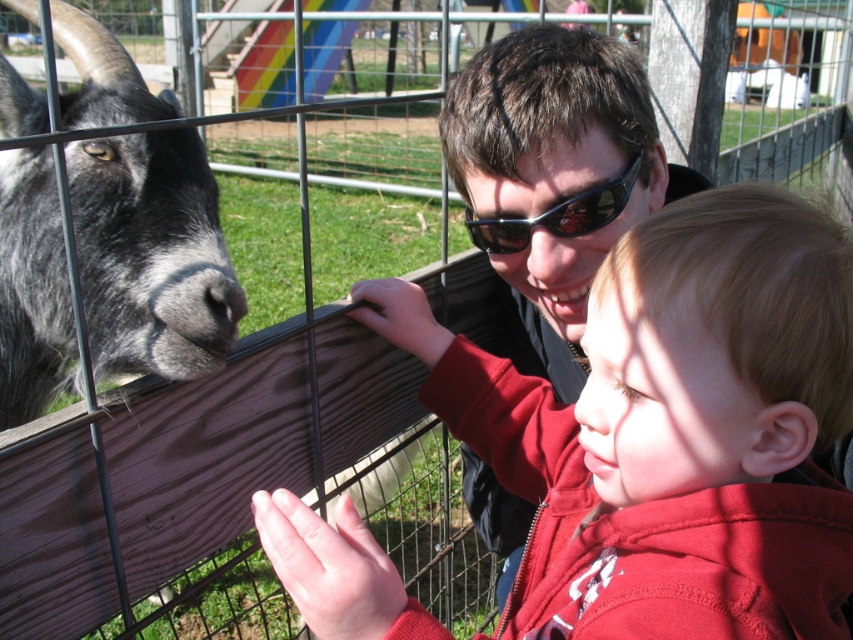
You are a photographer standing behind the matte red hoodie at center and the gray woolen goat at left. You want to take a photo that includes both subjects without any obstruction. Which subject should you move closer to the camera to ensure both are in focus?

The matte red hoodie at center is already closer to the viewer than the gray woolen goat at left. To ensure both are in focus, you should move the gray woolen goat at left closer to the camera so that it is at the same distance as the matte red hoodie at center.

You are a photographer trying to capture a candid shot of the child and the goat. You have a camera with a 35mm lens. Knowing that the matte red hoodie at center is wider than the sunglasses at center, can you fit both objects in the frame if you position the camera to focus on the child?

Yes, since the matte red hoodie at center is wider than the sunglasses at center, both objects can fit within the 35mm lens frame when focusing on the child.

You are a photographer trying to capture a photo of the gray woolen goat at left and the sunglasses at center. Since you want both subjects to be in focus, you need to know which one is taller. Can you tell me which is taller?

The gray woolen goat at left is much taller than the sunglasses at center, so you should adjust your camera settings to focus on the taller subject first.